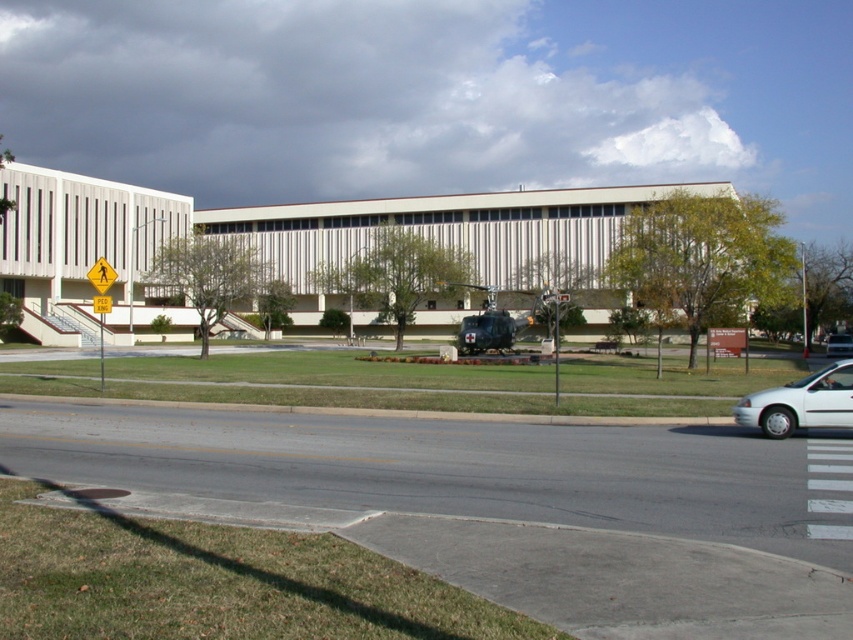
Question: Does white matte van at lower right appear on the right side of white matte sedan at center?

Choices:
 (A) yes
 (B) no

Answer: (B)

Question: Is yellow reflective pedestrian crossing sign at upper center closer to camera compared to white matte sedan at center?

Choices:
 (A) yes
 (B) no

Answer: (A)

Question: Can you confirm if yellow reflective pedestrian crossing sign at upper center is bigger than white matte sedan at center?

Choices:
 (A) no
 (B) yes

Answer: (B)

Question: Estimate the real-world distances between objects in this image. Which object is closer to the yellow reflective pedestrian crossing sign at upper center?

Choices:
 (A) white matte sedan at center
 (B) white matte van at lower right

Answer: (B)

Question: Among these points, which one is farthest from the camera?

Choices:
 (A) (96, 272)
 (B) (843, 417)
 (C) (840, 336)

Answer: (C)

Question: Which is nearer to the white matte van at lower right?

Choices:
 (A) white matte sedan at center
 (B) yellow reflective pedestrian crossing sign at upper center

Answer: (B)